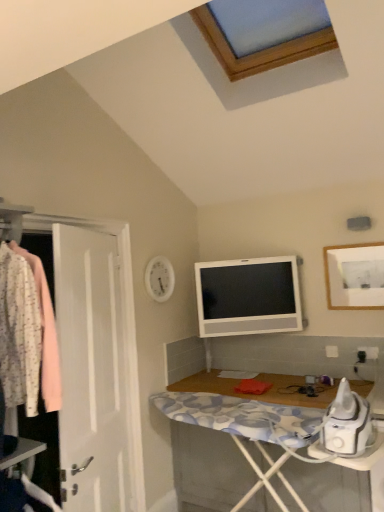
What is the approximate width of floral fabric shirt at left?

It is 17.53 inches.

I want to click on white glossy television at upper center, so click(x=248, y=296).

Find the location of a particular element. This screenshot has width=384, height=512. floral fabric shirt at left is located at coordinates (45, 333).

What's the angular difference between white glossy television at upper center and floral fabric shirt at left's facing directions?

The angular difference between white glossy television at upper center and floral fabric shirt at left is 55.6 degrees.

Is white glossy television at upper center thinner than floral fabric shirt at left?

Yes, white glossy television at upper center is thinner than floral fabric shirt at left.

Is white glossy television at upper center not within floral fabric shirt at left?

Yes, white glossy television at upper center is not within floral fabric shirt at left.

Which is behind, white glossy television at upper center or floral fabric shirt at left?

white glossy television at upper center is behind.

Can you confirm if white glossy television at upper center is wider than white wood desk at lower right?

No, white glossy television at upper center is not wider than white wood desk at lower right.

Considering the relative sizes of white glossy television at upper center and white wood desk at lower right in the image provided, is white glossy television at upper center smaller than white wood desk at lower right?

Correct, white glossy television at upper center occupies less space than white wood desk at lower right.

Could you tell me if white glossy television at upper center is turned towards white wood desk at lower right?

No, white glossy television at upper center does not turn towards white wood desk at lower right.

From the image's perspective, who appears lower, white glossy television at upper center or white wood desk at lower right?

white wood desk at lower right, from the image's perspective.

From the image's perspective, is floral fabric shirt at left located above white glossy television at upper center?

Yes, from the image's perspective, floral fabric shirt at left is on top of white glossy television at upper center.

Looking at this image, does floral fabric shirt at left have a smaller size compared to white glossy television at upper center?

Incorrect, floral fabric shirt at left is not smaller in size than white glossy television at upper center.

Where is `television below the floral fabric shirt at left (from a real-world perspective)`? This screenshot has width=384, height=512. television below the floral fabric shirt at left (from a real-world perspective) is located at coordinates (248, 296).

Is floral fabric shirt at left touching white glossy television at upper center?

No, floral fabric shirt at left is not touching white glossy television at upper center.

From a real-world perspective, is floral fabric shirt at left under white matte picture frame at upper right?

Yes.

Is floral fabric shirt at left turned away from white matte picture frame at upper right?

No, floral fabric shirt at left's orientation is not away from white matte picture frame at upper right.

Locate an element on the screen. The image size is (384, 512). picture frame in front of the white glossy television at upper center is located at coordinates (354, 276).

Are white glossy television at upper center and white matte picture frame at upper right far apart?

No, white glossy television at upper center is in close proximity to white matte picture frame at upper right.

Is point (284, 271) closer to viewer compared to point (329, 302)?

No, (284, 271) is further to viewer.

Can you confirm if floral fabric shirt at left is wider than white wood desk at lower right?

No.

Is floral fabric shirt at left oriented towards white wood desk at lower right?

No, floral fabric shirt at left does not turn towards white wood desk at lower right.

Where is `clothing that is in front of the white wood desk at lower right`? Image resolution: width=384 pixels, height=512 pixels. clothing that is in front of the white wood desk at lower right is located at coordinates (45, 333).

Which object is further away from the camera taking this photo, white wood desk at lower right or white glossy television at upper center?

white glossy television at upper center is further away from the camera.

Find the location of `desk beneath the white glossy television at upper center (from a real-world perspective)`. desk beneath the white glossy television at upper center (from a real-world perspective) is located at coordinates (257, 444).

Does white wood desk at lower right have a greater width compared to white glossy television at upper center?

Yes.

Which of these two, white wood desk at lower right or white glossy television at upper center, is smaller?

white glossy television at upper center.

What are the coordinates of `clothing above the white glossy television at upper center (from the image's perspective)` in the screenshot? It's located at (45, 333).

I want to click on desk on the right of the white glossy television at upper center, so click(x=257, y=444).

Considering their positions, is white wood desk at lower right positioned further to white glossy television at upper center than floral fabric shirt at left?

Based on the image, floral fabric shirt at left appears to be further to white glossy television at upper center.

Estimate the real-world distances between objects in this image. Which object is further from floral fabric shirt at left, white wood desk at lower right or white glossy television at upper center?

white glossy television at upper center is positioned further to the anchor floral fabric shirt at left.

From the image, which object appears to be farther from floral fabric shirt at left, white wood desk at lower right or white matte picture frame at upper right?

white matte picture frame at upper right is further to floral fabric shirt at left.

Considering their positions, is white matte picture frame at upper right positioned closer to white wood desk at lower right than white glossy television at upper center?

The object closer to white wood desk at lower right is white glossy television at upper center.

When comparing their distances from white wood desk at lower right, does white matte picture frame at upper right or floral fabric shirt at left seem closer?

The object closer to white wood desk at lower right is white matte picture frame at upper right.

Looking at the image, which one is located further to white matte picture frame at upper right, white glossy television at upper center or floral fabric shirt at left?

floral fabric shirt at left.

From the image, which object appears to be farther from white glossy television at upper center, white matte picture frame at upper right or white wood desk at lower right?

white wood desk at lower right is further to white glossy television at upper center.

Based on their spatial positions, is white glossy television at upper center or white matte picture frame at upper right further from white wood desk at lower right?

white matte picture frame at upper right is further to white wood desk at lower right.

Find the location of a particular element. The image size is (384, 512). desk between floral fabric shirt at left and white matte picture frame at upper right in the horizontal direction is located at coordinates 257,444.

Find the location of a particular element. The image size is (384, 512). television that lies between white matte picture frame at upper right and white wood desk at lower right from top to bottom is located at coordinates (248, 296).

Locate an element on the screen. desk positioned between floral fabric shirt at left and white glossy television at upper center from near to far is located at coordinates (257, 444).

At what (x,y) coordinates should I click in order to perform the action: click on television located between floral fabric shirt at left and white matte picture frame at upper right in the left-right direction. Please return your answer as a coordinate pair (x, y). The image size is (384, 512). Looking at the image, I should click on (248, 296).